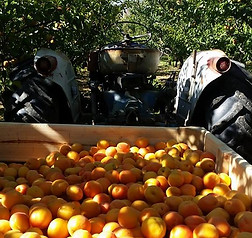
Locate an element on the screen. 1 beige wooden fruit container is located at coordinates (237, 165).